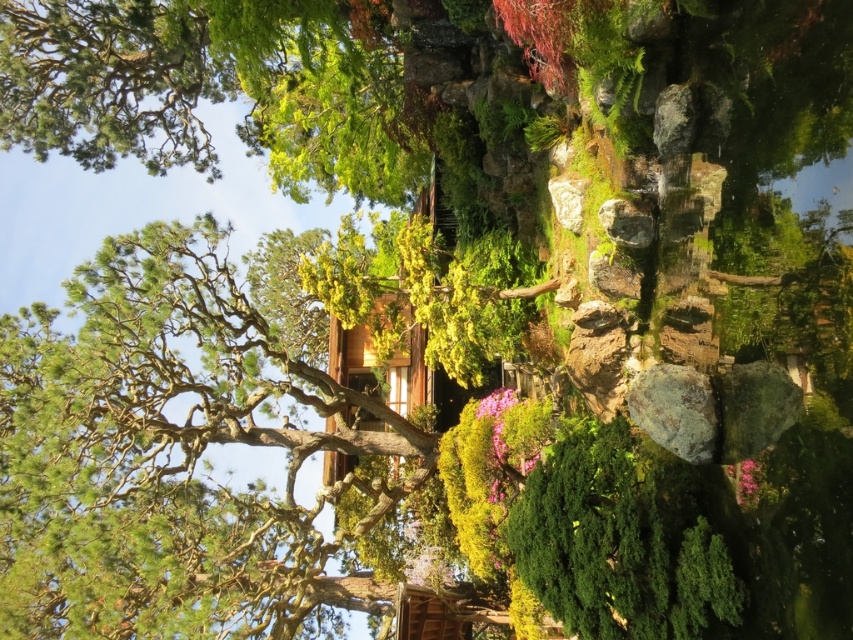
Who is lower down, green textured tree at center or pink matte flower at center?

pink matte flower at center is lower down.

You are a GUI agent. You are given a task and a screenshot of the screen. Output one action in this format:
    pyautogui.click(x=<x>, y=<y>)
    Task: Click on the green textured tree at center
    This screenshot has width=853, height=640.
    Given the screenshot: What is the action you would take?
    pyautogui.click(x=163, y=454)

Is green textured tree at center closer to camera compared to gray rough rock at center-right?

No.

Which is in front, point (199, 483) or point (666, 381)?

Positioned in front is point (666, 381).

This screenshot has height=640, width=853. Find the location of `green textured tree at center`. green textured tree at center is located at coordinates (163, 454).

How much distance is there between gray rough rock at center-right and pink matte flower at center?

They are 9.11 meters apart.

Who is positioned more to the right, gray rough rock at center-right or pink matte flower at center?

gray rough rock at center-right is more to the right.

Find the location of a particular element. gray rough rock at center-right is located at coordinates (675, 410).